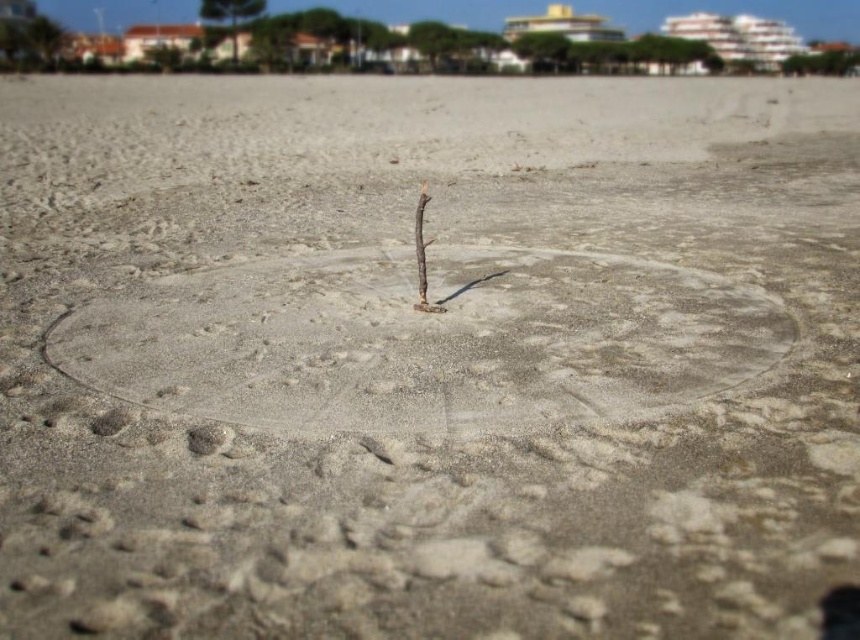
Question: Is smooth sand circle at center below brown rough twig at center?

Choices:
 (A) yes
 (B) no

Answer: (A)

Question: Which point is closer to the camera taking this photo?

Choices:
 (A) (435, 308)
 (B) (155, 378)

Answer: (B)

Question: Which of the following is the closest to the observer?

Choices:
 (A) (140, 298)
 (B) (425, 285)

Answer: (B)

Question: Does smooth sand circle at center appear under brown rough twig at center?

Choices:
 (A) no
 (B) yes

Answer: (B)

Question: Which object is closer to the camera taking this photo?

Choices:
 (A) smooth sand circle at center
 (B) brown rough twig at center

Answer: (A)

Question: Does smooth sand circle at center appear on the left side of brown rough twig at center?

Choices:
 (A) no
 (B) yes

Answer: (A)